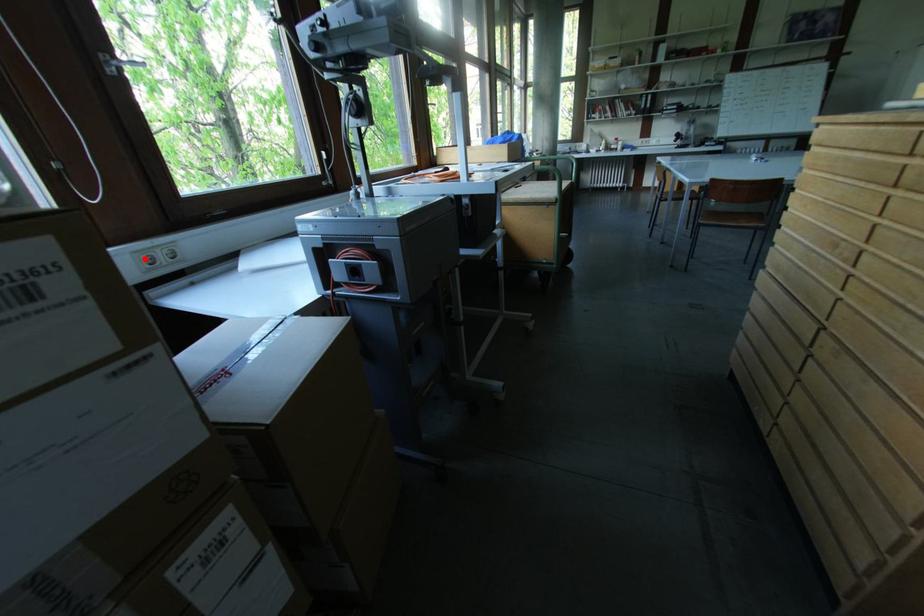
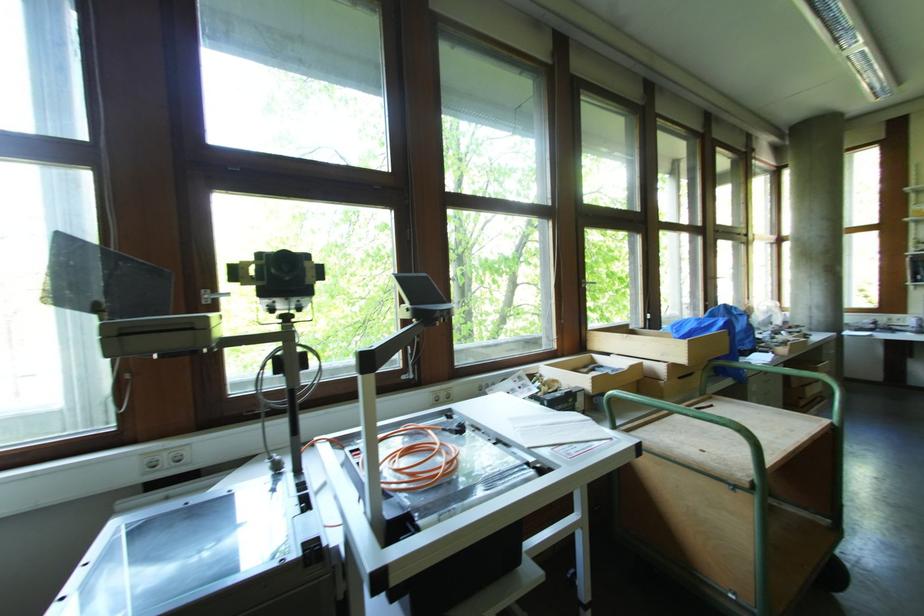
Question: I am providing you with two images of the same scene from different viewpoints. A red point is marked on the first image. Can you still see the location of the red point in image 2?

Choices:
 (A) Yes
 (B) No

Answer: (A)